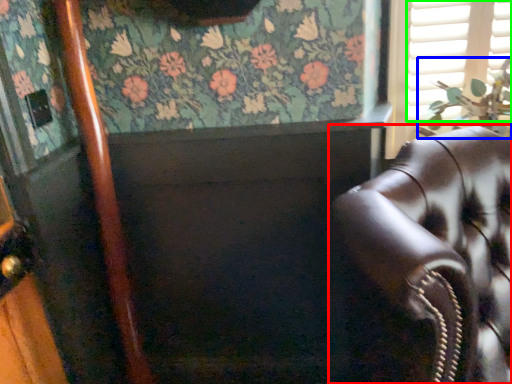
Question: Based on their relative distances, which object is farther from chair (highlighted by a red box)? Choose from plant (highlighted by a blue box) and shutter (highlighted by a green box).

Choices:
 (A) plant
 (B) shutter

Answer: (B)